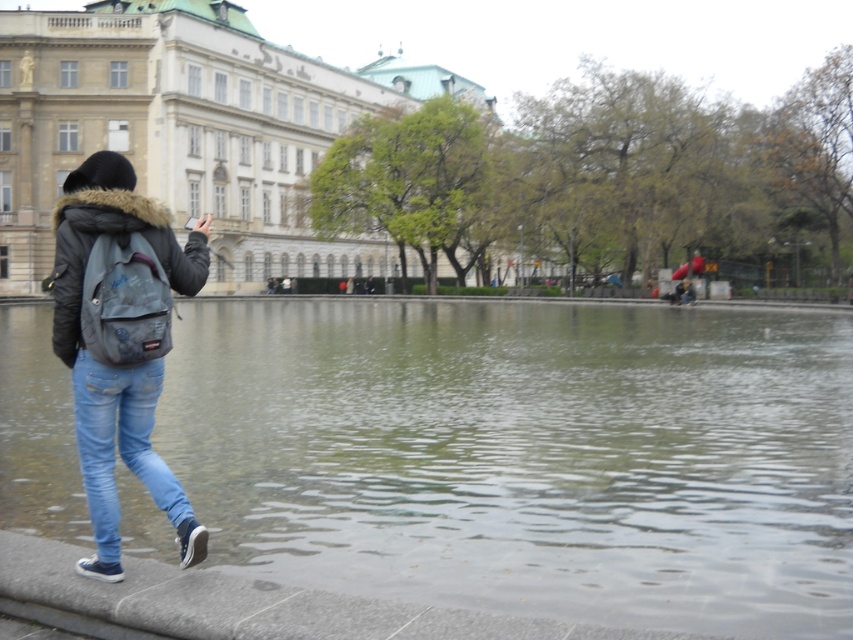
Can you confirm if light blue denim jeans at lower left is positioned below denim backpack at left?

Indeed, light blue denim jeans at lower left is positioned under denim backpack at left.

Who is taller, light blue denim jeans at lower left or denim backpack at left?

Standing taller between the two is light blue denim jeans at lower left.

Locate an element on the screen. The height and width of the screenshot is (640, 853). light blue denim jeans at lower left is located at coordinates (125, 449).

You are a GUI agent. You are given a task and a screenshot of the screen. Output one action in this format:
    pyautogui.click(x=<x>, y=<y>)
    Task: Click on the light blue denim jeans at lower left
    This screenshot has height=640, width=853.
    Given the screenshot: What is the action you would take?
    pyautogui.click(x=125, y=449)

Who is more forward, (9, 460) or (80, 451)?

Positioned in front is point (80, 451).

Is the position of clear water at center less distant than that of denim jacket at left?

That is False.

Identify the location of clear water at center. This screenshot has height=640, width=853. (525, 454).

Image resolution: width=853 pixels, height=640 pixels. I want to click on clear water at center, so click(x=525, y=454).

Is clear water at center in front of denim backpack at left?

No.

Who is more forward, (248, 545) or (167, 339)?

Point (167, 339) is more forward.

This screenshot has width=853, height=640. I want to click on clear water at center, so click(525, 454).